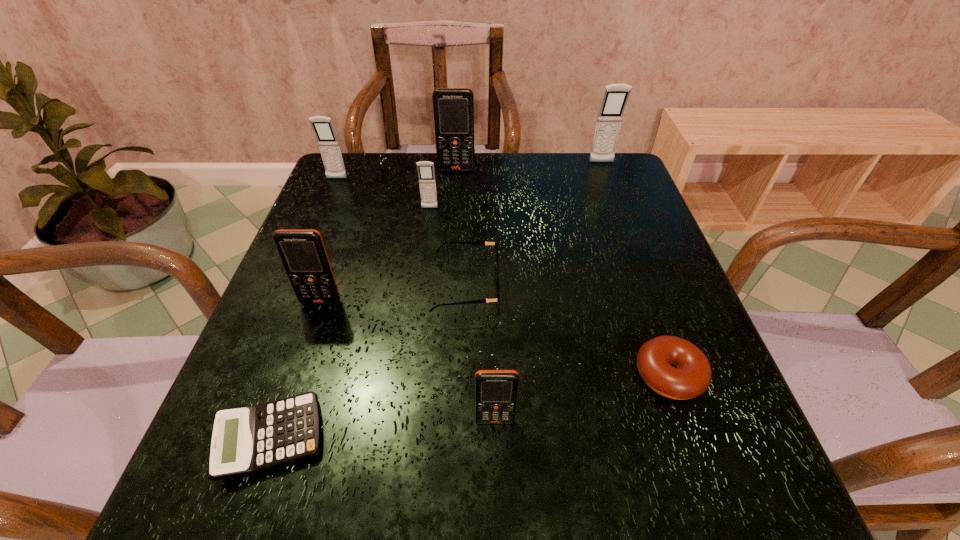
You are a GUI agent. You are given a task and a screenshot of the screen. Output one action in this format:
    pyautogui.click(x=<x>, y=<y>)
    Task: Click on the second gray cellular telephone from right to left
    
    Given the screenshot: What is the action you would take?
    pyautogui.click(x=426, y=174)

The height and width of the screenshot is (540, 960). Identify the location of the nearest gray cellular telephone. (426, 174).

This screenshot has height=540, width=960. I want to click on spectacles, so click(x=475, y=243).

Where is `doughnut`? The height and width of the screenshot is (540, 960). doughnut is located at coordinates (691, 375).

The height and width of the screenshot is (540, 960). Identify the location of the shortest object. 246,440.

This screenshot has height=540, width=960. Identify the location of vacant space located 0.340m on the front-facing side of the farthest cellular telephone. (x=632, y=245).

At what (x,y) coordinates should I click in order to perform the action: click on vacant region located on the screen of the second orange cellular telephone from left to right. Please return your answer as a coordinate pair (x, y). This screenshot has height=540, width=960. Looking at the image, I should click on (451, 242).

You are a GUI agent. You are given a task and a screenshot of the screen. Output one action in this format:
    pyautogui.click(x=<x>, y=<y>)
    Task: Click on the vacant area located on the front-facing side of the second biggest gray cellular telephone
    The image size is (960, 540).
    Given the screenshot: What is the action you would take?
    pyautogui.click(x=328, y=199)

I want to click on free location located 0.140m on the screen of the leftmost orange cellular telephone, so click(300, 367).

Where is `free space located 0.110m on the screen of the second cellular telephone from right to left`? free space located 0.110m on the screen of the second cellular telephone from right to left is located at coordinates point(497,500).